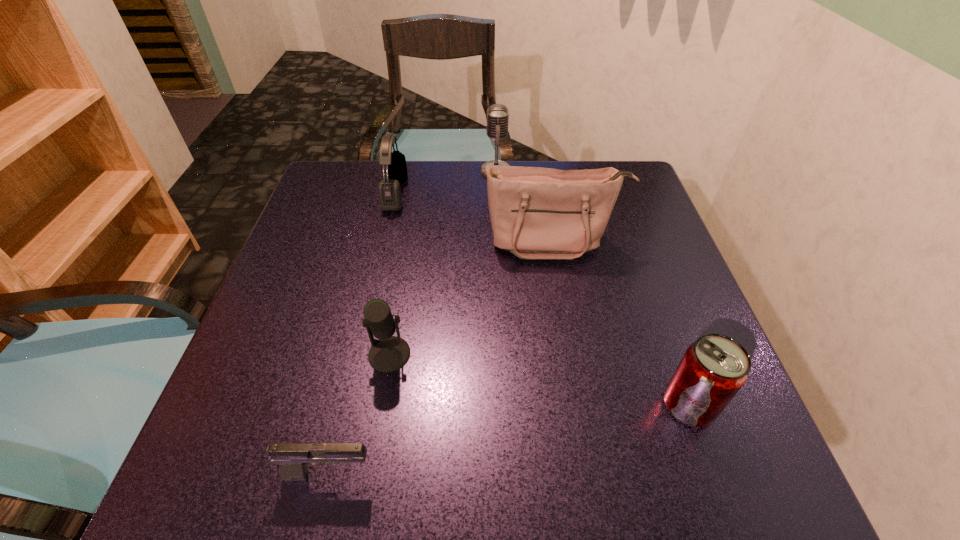
The width and height of the screenshot is (960, 540). Find the location of `free space in the image that satisfies the following two spatial constraints: 1. on the front pocket of the shoulder bag; 2. on the left side of the pop soda`. free space in the image that satisfies the following two spatial constraints: 1. on the front pocket of the shoulder bag; 2. on the left side of the pop soda is located at coordinates (583, 404).

What are the coordinates of `vacant space that satisfies the following two spatial constraints: 1. on the front pocket of the shoulder bag; 2. on the left side of the pop soda` in the screenshot? It's located at (583, 404).

Find the location of a particular element. Image resolution: width=960 pixels, height=540 pixels. free spot that satisfies the following two spatial constraints: 1. on the headband of the headset; 2. on the left side of the nearer microphone is located at coordinates 360,354.

This screenshot has width=960, height=540. Identify the location of free spot that satisfies the following two spatial constraints: 1. on the front side of the right microphone; 2. aim along the barrel of the shortest object. (510, 474).

Where is `vacant point that satisfies the following two spatial constraints: 1. on the headband of the shorter microphone; 2. on the left side of the headset`? vacant point that satisfies the following two spatial constraints: 1. on the headband of the shorter microphone; 2. on the left side of the headset is located at coordinates (360, 354).

You are a GUI agent. You are given a task and a screenshot of the screen. Output one action in this format:
    pyautogui.click(x=<x>, y=<y>)
    Task: Click on the free space that satisfies the following two spatial constraints: 1. on the headband of the headset; 2. on the right side of the pop soda
    This screenshot has width=960, height=540.
    Given the screenshot: What is the action you would take?
    pyautogui.click(x=348, y=404)

Locate an element on the screen. The image size is (960, 540). vacant area in the image that satisfies the following two spatial constraints: 1. on the front side of the right microphone; 2. on the headband of the headset is located at coordinates (497, 193).

The height and width of the screenshot is (540, 960). Identify the location of free spot that satisfies the following two spatial constraints: 1. on the headband of the pop soda; 2. on the left side of the headset. click(x=348, y=404).

Find the location of `vacant area that satisfies the following two spatial constraints: 1. on the front pocket of the second nearest object; 2. on the right side of the third farthest object`. vacant area that satisfies the following two spatial constraints: 1. on the front pocket of the second nearest object; 2. on the right side of the third farthest object is located at coordinates (583, 404).

Where is `vacant position in the image that satisfies the following two spatial constraints: 1. on the back side of the left microphone; 2. on the headband of the headset`? The height and width of the screenshot is (540, 960). vacant position in the image that satisfies the following two spatial constraints: 1. on the back side of the left microphone; 2. on the headband of the headset is located at coordinates (417, 193).